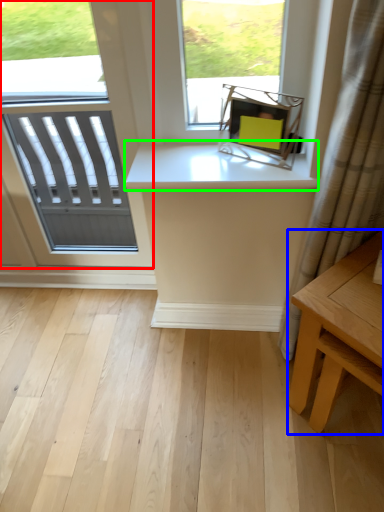
Question: Which is farther away from window (highlighted by a red box)? table (highlighted by a blue box) or counter top (highlighted by a green box)?

Choices:
 (A) table
 (B) counter top

Answer: (A)